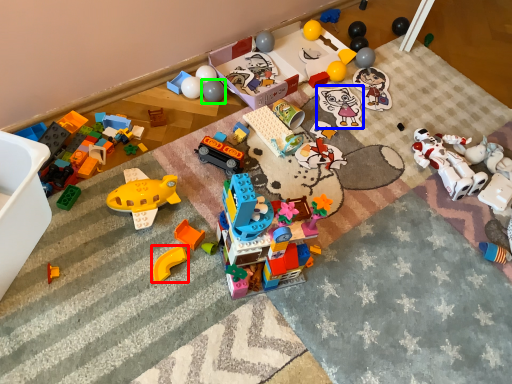
Question: Considering the real-world distances, which object is farthest from toy (highlighted by a red box)? toy (highlighted by a blue box) or toy (highlighted by a green box)?

Choices:
 (A) toy
 (B) toy

Answer: (A)